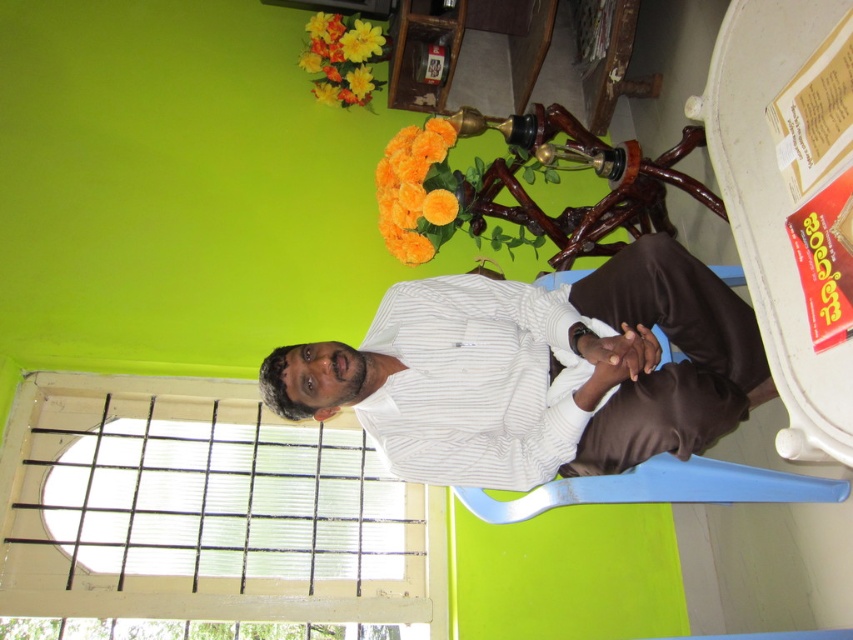
Question: Which point is farther from the camera taking this photo?

Choices:
 (A) (486, 337)
 (B) (544, 476)
 (C) (334, 48)
 (D) (380, 193)

Answer: (C)

Question: Among these objects, which one is farthest from the camera?

Choices:
 (A) white striped dress shirt at center
 (B) orange artificial flowers at upper center
 (C) orange matte flowers at center

Answer: (B)

Question: Which point is farther to the camera?

Choices:
 (A) click(x=744, y=368)
 (B) click(x=425, y=248)

Answer: (B)

Question: Does white striped dress shirt at center appear under blue plastic chair at right?

Choices:
 (A) no
 (B) yes

Answer: (A)

Question: In this image, where is white striped dress shirt at center located relative to orange artificial flowers at upper center?

Choices:
 (A) above
 (B) below

Answer: (B)

Question: Does white striped shirt at center lie in front of orange artificial flowers at upper center?

Choices:
 (A) no
 (B) yes

Answer: (B)